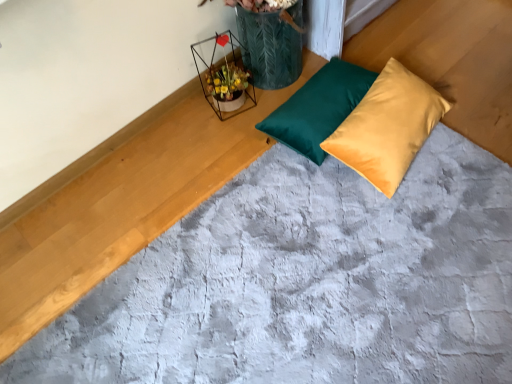
Find the location of a particular element. free space to the left of satin yellow pillow at center, the second pillow when ordered from left to right is located at coordinates (283, 202).